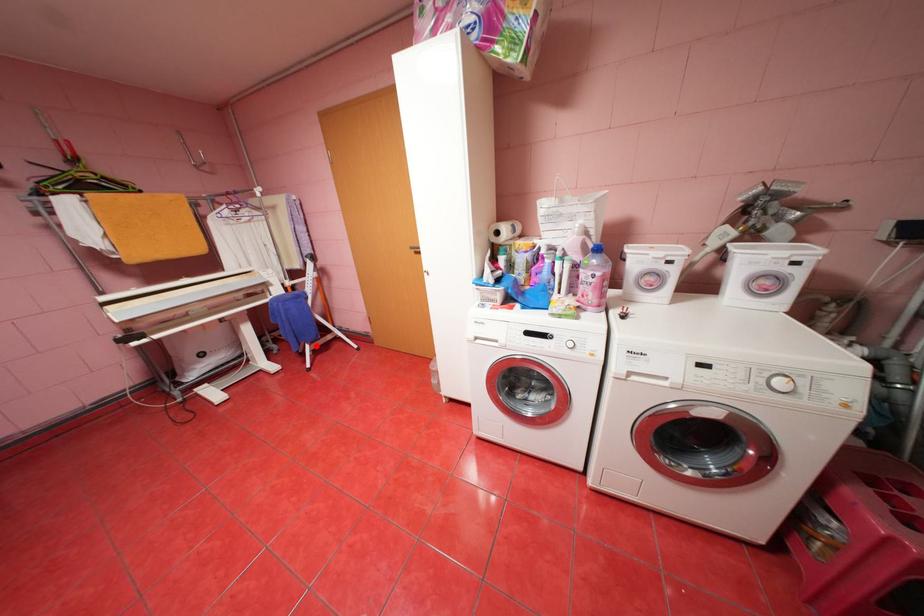
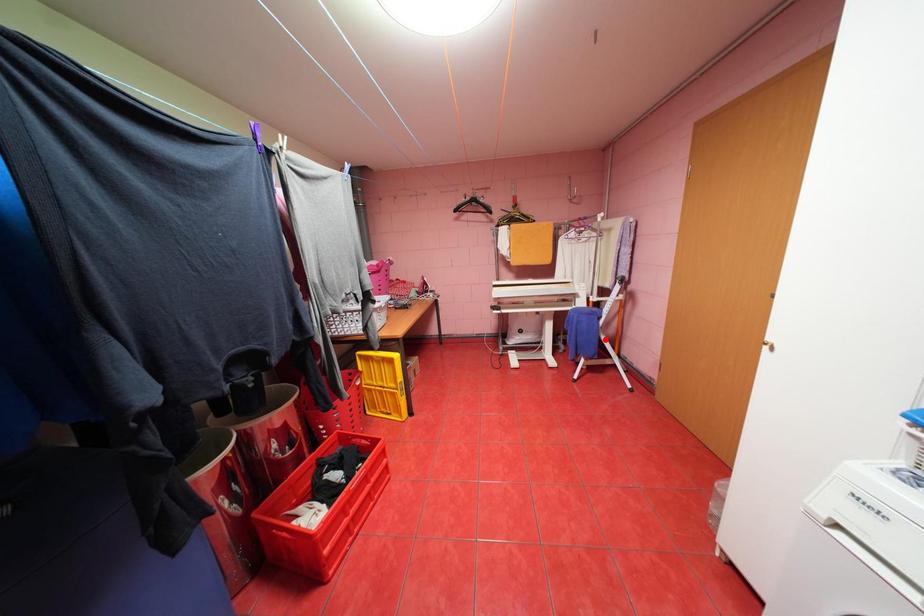
I am providing you with two images of the same scene from different viewpoints. A red point is marked on the first image and another point is marked on the second image. Is the red point in image1 aligned with the point shown in image2?

No